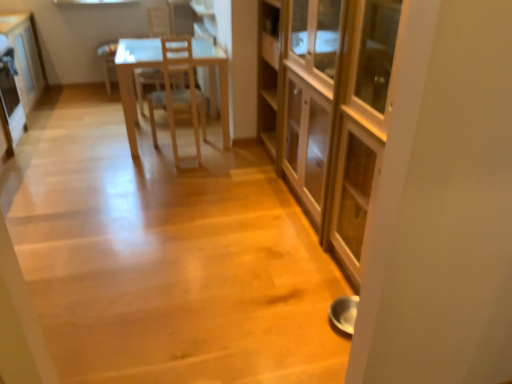
Question: Is matte wooden cabinet at center, marked as the 1th cabinetry in a front-to-back arrangement, outside metallic refrigerator at left?

Choices:
 (A) yes
 (B) no

Answer: (A)

Question: Does matte wooden cabinet at center, the second cabinetry positioned from the left, have a smaller size compared to metallic refrigerator at left?

Choices:
 (A) yes
 (B) no

Answer: (B)

Question: Can you confirm if matte wooden cabinet at center, the second cabinetry positioned from the left, is thinner than metallic refrigerator at left?

Choices:
 (A) no
 (B) yes

Answer: (A)

Question: From a real-world perspective, is matte wooden cabinet at center, the second cabinetry positioned from the left, over metallic refrigerator at left?

Choices:
 (A) yes
 (B) no

Answer: (A)

Question: From the image's perspective, is matte wooden cabinet at center, the second cabinetry positioned from the left, under metallic refrigerator at left?

Choices:
 (A) yes
 (B) no

Answer: (A)

Question: In terms of height, does light brown wooden chair at center look taller or shorter compared to white glossy cabinet at upper left, the second cabinetry when ordered from right to left?

Choices:
 (A) tall
 (B) short

Answer: (A)

Question: Considering the positions of light brown wooden chair at center and white glossy cabinet at upper left, the first cabinetry when ordered from left to right, in the image, is light brown wooden chair at center bigger or smaller than white glossy cabinet at upper left, the first cabinetry when ordered from left to right,?

Choices:
 (A) big
 (B) small

Answer: (B)

Question: From a real-world perspective, is light brown wooden chair at center physically located above or below white glossy cabinet at upper left, the 2th cabinetry from the front?

Choices:
 (A) below
 (B) above

Answer: (B)

Question: Is light brown wooden chair at center in front of or behind white glossy cabinet at upper left, which is the first cabinetry from back to front, in the image?

Choices:
 (A) behind
 (B) front

Answer: (A)

Question: From the image's perspective, relative to matte wooden cabinet at center, which is the first cabinetry from right to left, is wooden chair at center above or below?

Choices:
 (A) below
 (B) above

Answer: (B)

Question: Based on their positions, is wooden chair at center located to the left or right of matte wooden cabinet at center, which is the first cabinetry from right to left?

Choices:
 (A) left
 (B) right

Answer: (A)

Question: Looking at their shapes, would you say wooden chair at center is wider or thinner than matte wooden cabinet at center, which appears as the second cabinetry when viewed from the back?

Choices:
 (A) thin
 (B) wide

Answer: (A)

Question: Considering the positions of point (200, 96) and point (297, 180), is point (200, 96) closer or farther from the camera than point (297, 180)?

Choices:
 (A) closer
 (B) farther

Answer: (B)

Question: Is metallic refrigerator at left to the left or to the right of wooden chair at center in the image?

Choices:
 (A) left
 (B) right

Answer: (A)

Question: Does point (15, 97) appear closer or farther from the camera than point (163, 54)?

Choices:
 (A) farther
 (B) closer

Answer: (A)